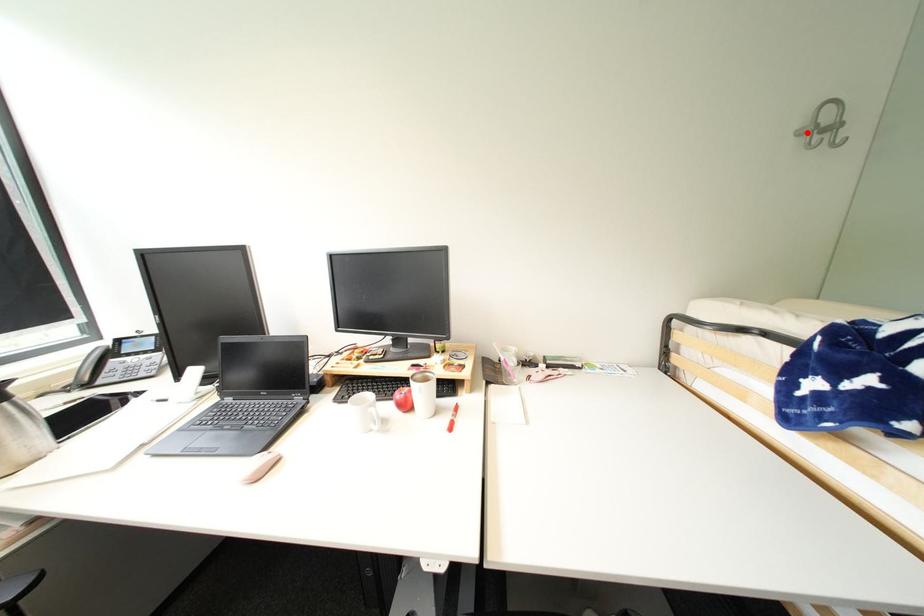
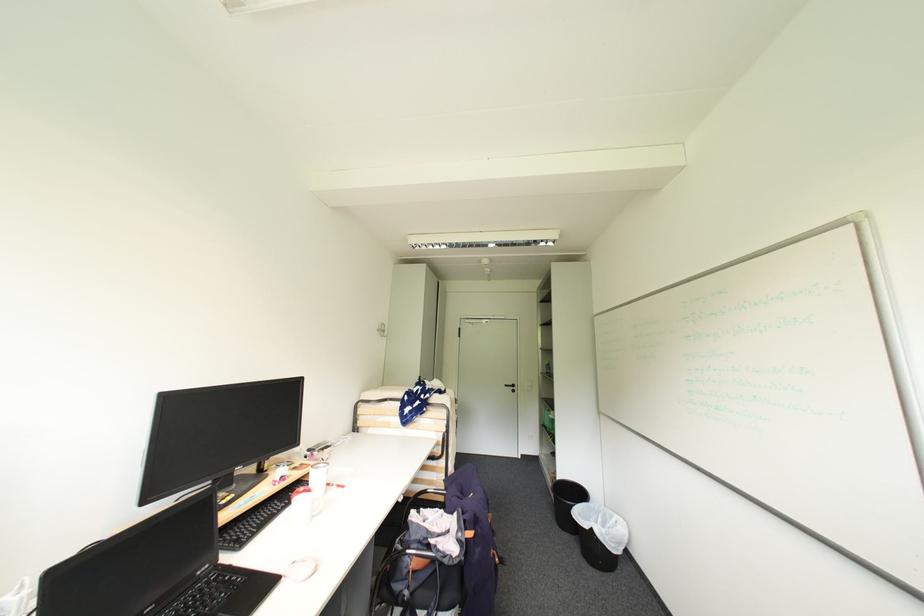
In the second image, find the point that corresponds to the highlighted location in the first image.

(384, 331)